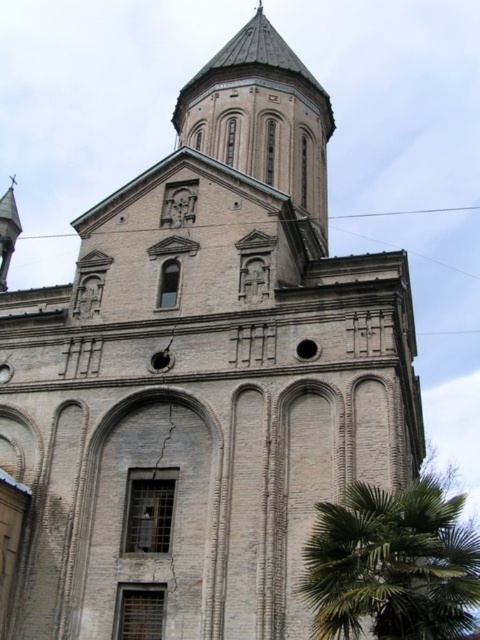
Question: Among these objects, which one is nearest to the camera?

Choices:
 (A) green leafy palm at lower right
 (B) brown stone bell tower at upper center

Answer: (A)

Question: Which point appears closest to the camera in this image?

Choices:
 (A) coord(370,532)
 (B) coord(194,134)

Answer: (A)

Question: Does green leafy palm at lower right have a greater width compared to brown stone bell tower at upper center?

Choices:
 (A) no
 (B) yes

Answer: (B)

Question: Is green leafy palm at lower right bigger than brown stone bell tower at upper center?

Choices:
 (A) no
 (B) yes

Answer: (B)

Question: Is green leafy palm at lower right further to camera compared to brown stone bell tower at upper center?

Choices:
 (A) yes
 (B) no

Answer: (B)

Question: Which point appears closest to the camera in this image?

Choices:
 (A) (285, 52)
 (B) (382, 497)

Answer: (B)